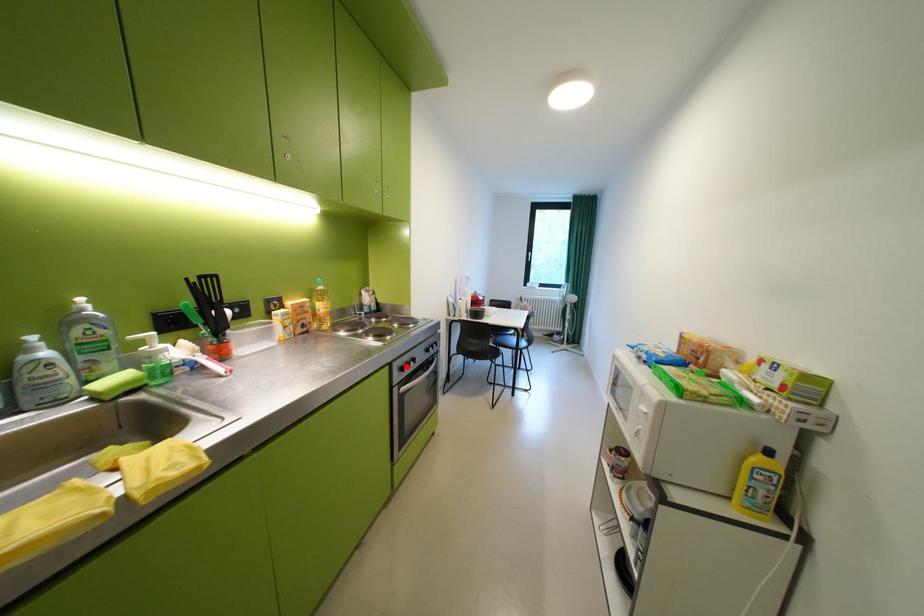
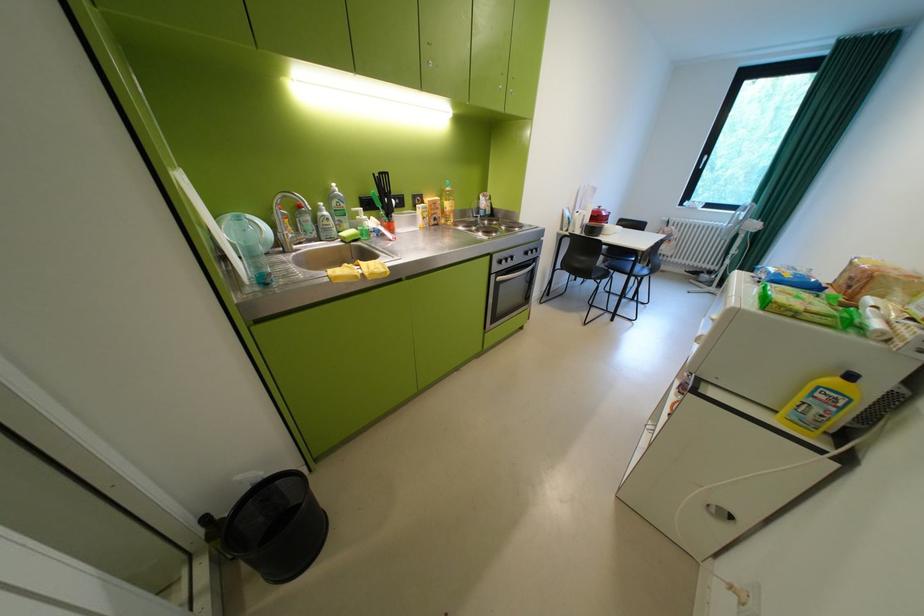
Find the pixel in the second image that matches the highlighted location in the first image.

(505, 257)